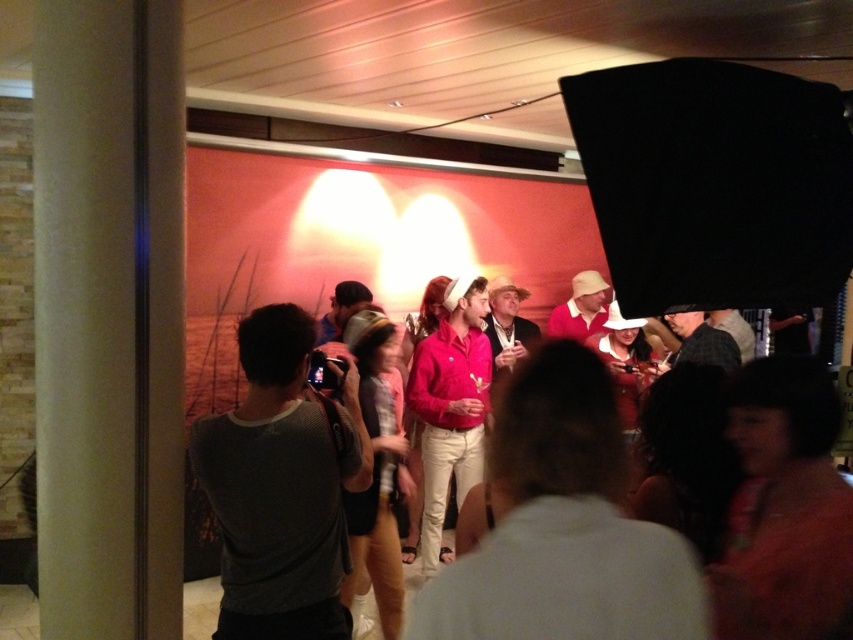
You are standing in the middle of the room and see two points marked in the image. Which point is nearer to you, point (247,472) or point (198,323)?

Point (247,472) is closer to the viewer than point (198,323).

You are at a social event and want to take a photo of the gray mesh shirt at left. The venue has a rule that photos must be taken from a distance of at least 2 meters to avoid disturbing guests. Given that you are standing at point 0.5, 0.5, can you take the photo without violating the rule?

The gray mesh shirt at left is located at point (x=281, y=486). The distance between your position at (x=426, y=320) and the gray mesh shirt at left is approximately 0.4 meters, which is less than the required 2 meters. Therefore, you cannot take the photo without violating the rule.